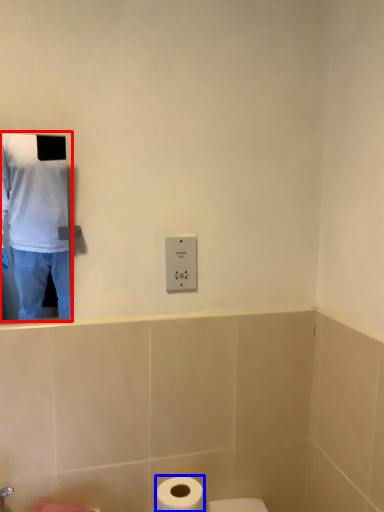
Question: Which of the following is the closest to the observer, man (highlighted by a red box) or toilet paper (highlighted by a blue box)?

Choices:
 (A) man
 (B) toilet paper

Answer: (A)